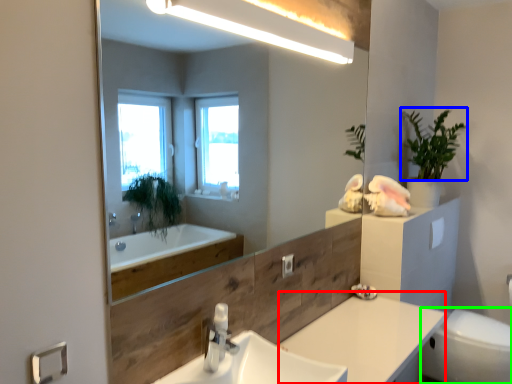
Question: Which object is the farthest from counter top (highlighted by a red box)? Choose among these: plant (highlighted by a blue box) or toilet bowl (highlighted by a green box).

Choices:
 (A) plant
 (B) toilet bowl

Answer: (A)